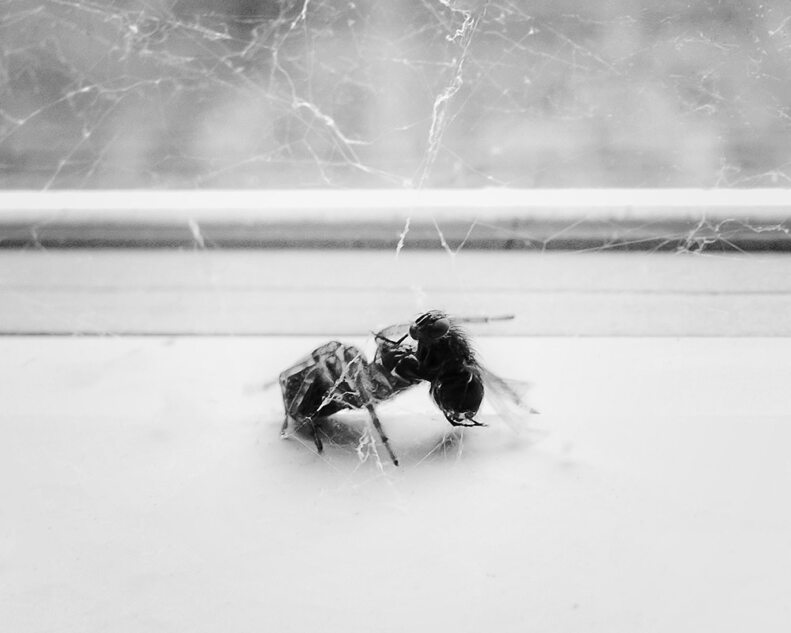
At what (x,y) coordinates should I click in order to perform the action: click on window. Please return your answer as a coordinate pair (x, y). The image size is (791, 633). Looking at the image, I should click on (392, 84).